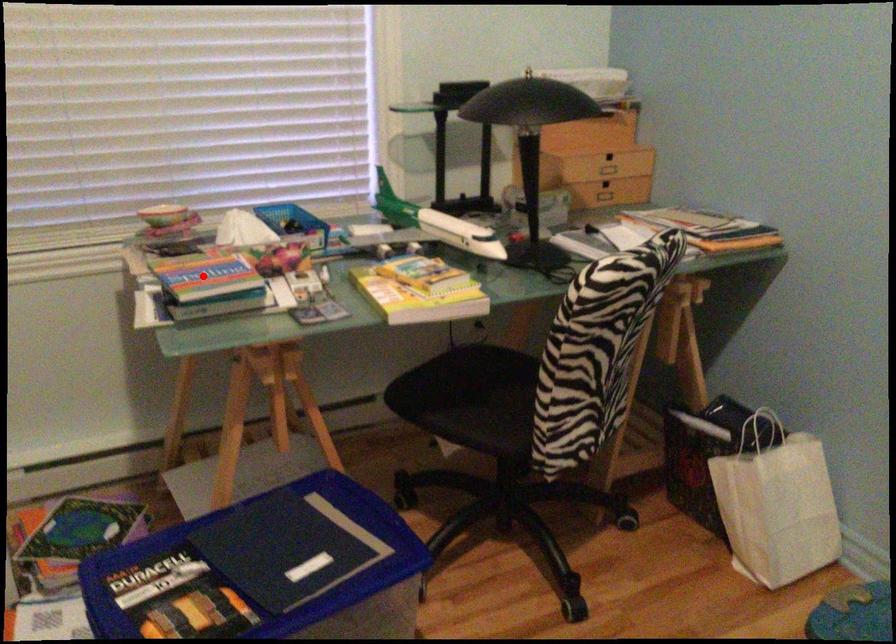
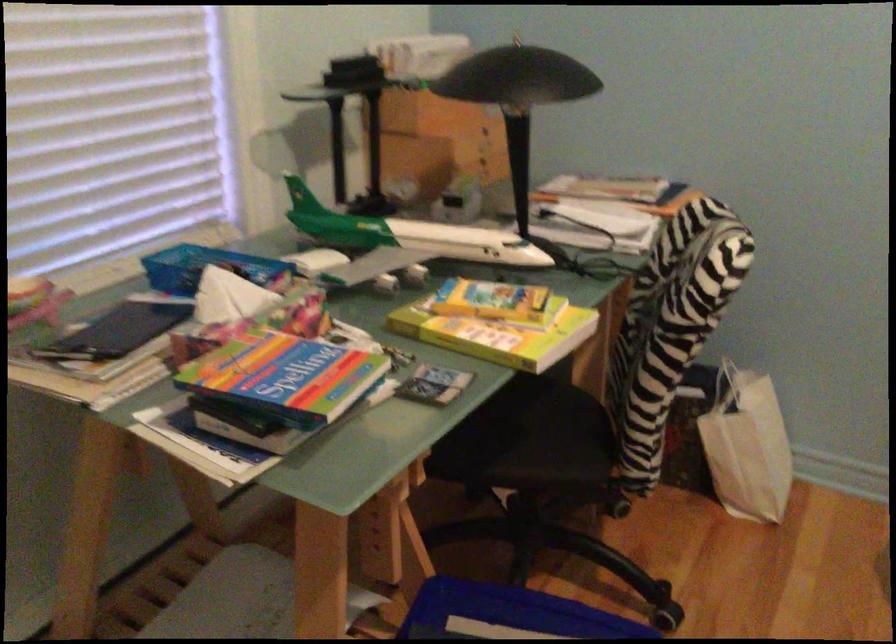
Question: I am providing you with two images of the same scene from different viewpoints. Image1 has a red point marked. In image2, the corresponding 3D location appears at what relative position? Reply with the corresponding letter.

Choices:
 (A) Closer
 (B) Farther

Answer: (A)